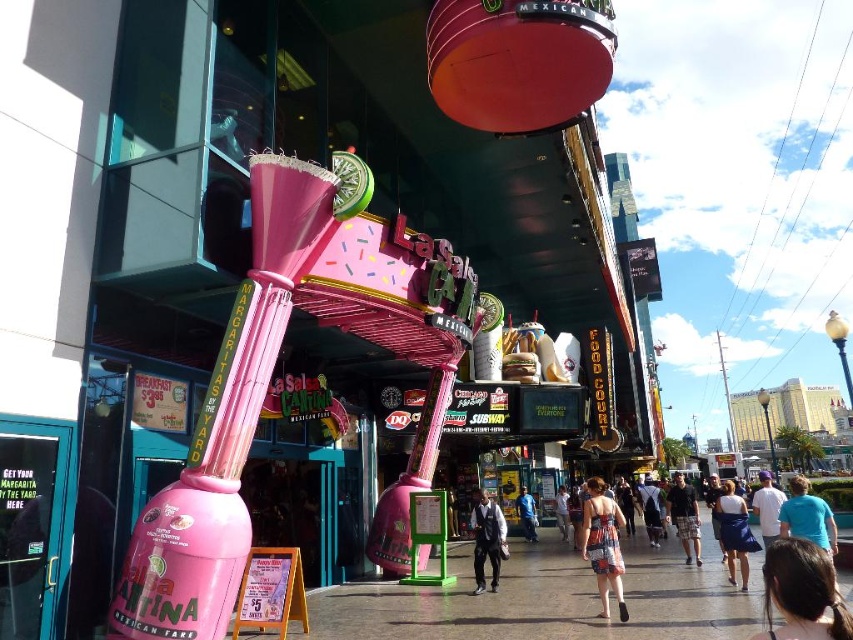
You are standing at the point labeled point at (490,547). You want to walk to the entrance of La Salsa Cantina, which is 30.15 feet away. If your walking speed is 3 feet per second, how many seconds will it take you to reach the entrance?

It will take you 10.05 seconds to reach the entrance of La Salsa Cantina because 30.15 divided by 3 equals 10.05 seconds.

You are a photographer standing in the lively street scene at La Salsa Cantina. You notice two features in the image that you want to capture in your next shot. The dark brown hair at lower right and the denim shorts at center. Which of these two features should you zoom in on to make them appear larger in your photo?

The denim shorts at center should be zoomed in on because the dark brown hair at lower right is smaller than denim shorts at center, so zooming in on the denim shorts at center will make them appear larger in the photo.